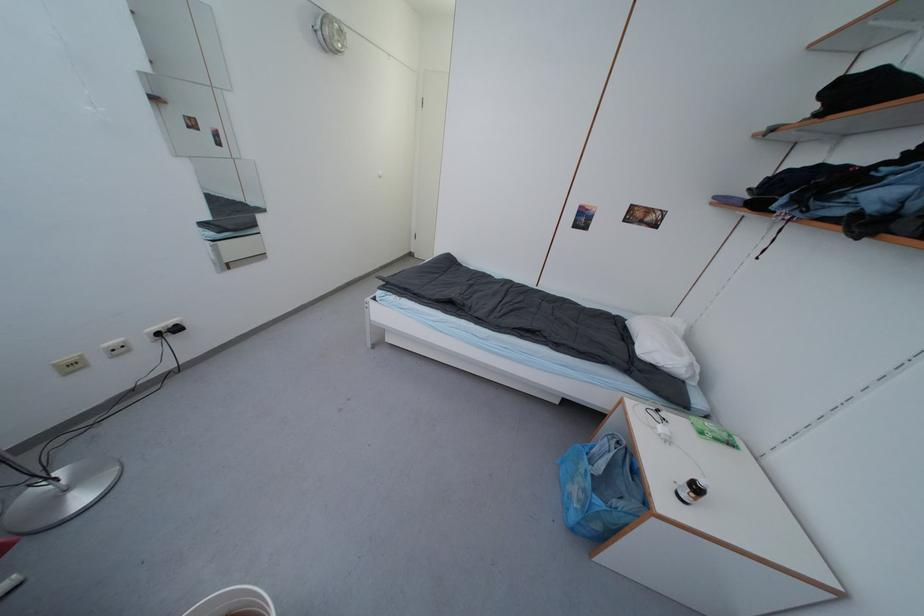
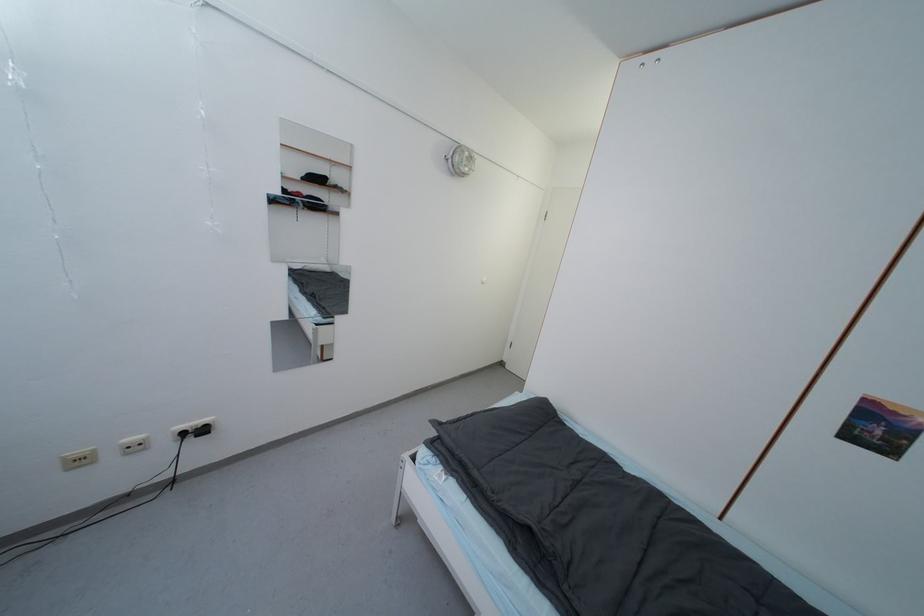
Where in the second image is the point corresponding to point 163,336 from the first image?

(187, 436)